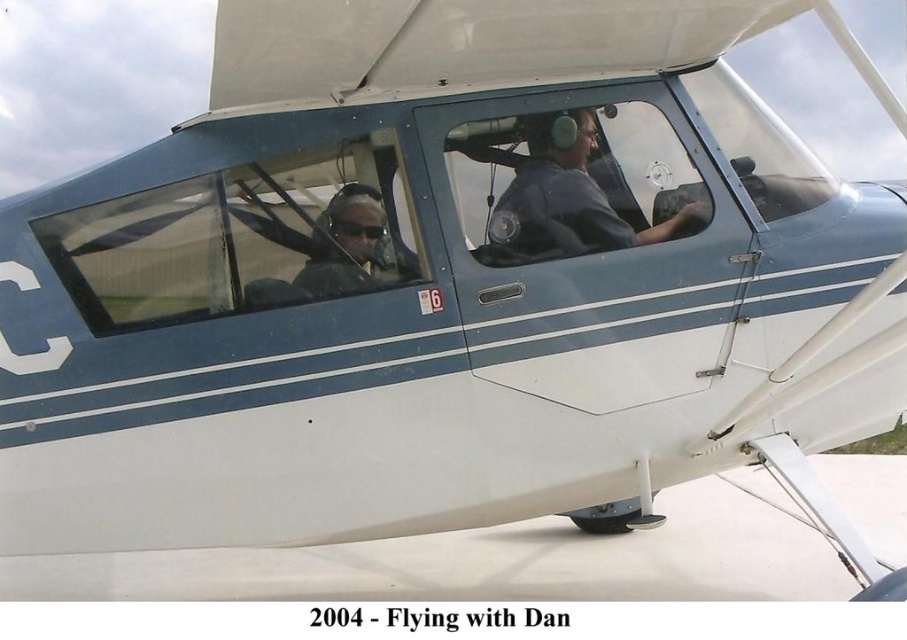
Question: Is matte black sunglasses at center further to the viewer compared to matte black cockpit at center?

Choices:
 (A) yes
 (B) no

Answer: (B)

Question: Considering the real-world distances, which object is closest to the matte black nose at center?

Choices:
 (A) matte blue shirt at center
 (B) matte black sunglasses at center

Answer: (B)

Question: Which point appears closest to the camera in this image?

Choices:
 (A) (596, 136)
 (B) (591, 221)
 (C) (368, 236)

Answer: (C)

Question: Is matte blue shirt at center to the left of matte black cockpit at center from the viewer's perspective?

Choices:
 (A) yes
 (B) no

Answer: (B)

Question: Is matte blue shirt at center smaller than matte black sunglasses at center?

Choices:
 (A) yes
 (B) no

Answer: (B)

Question: Considering the real-world distances, which object is farthest from the matte black sunglasses at center?

Choices:
 (A) matte black cockpit at center
 (B) matte black nose at center
 (C) matte blue shirt at center

Answer: (A)